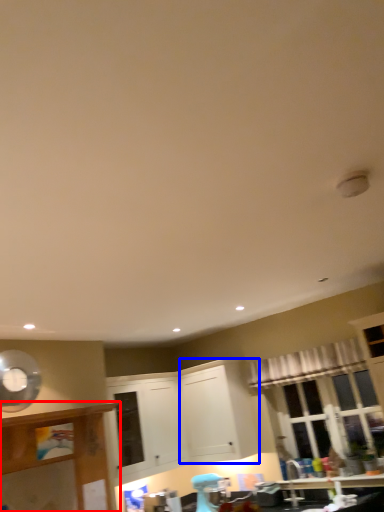
Question: Which of the following is the closest to the observer, cabinetry (highlighted by a red box) or cabinetry (highlighted by a blue box)?

Choices:
 (A) cabinetry
 (B) cabinetry

Answer: (A)